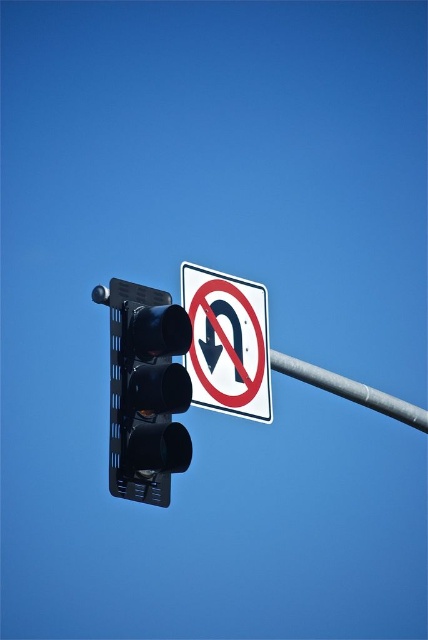
Between white plastic sign at upper center and metallic gray pole at center, which one is positioned lower?

metallic gray pole at center is below.

Does point (261, 420) come behind point (379, 401)?

No, it is in front of (379, 401).

The height and width of the screenshot is (640, 428). Identify the location of white plastic sign at upper center. (228, 342).

Can you confirm if black matte traffic light at left is positioned above white plastic sign at upper center?

No, black matte traffic light at left is not above white plastic sign at upper center.

Describe the element at coordinates (146, 392) in the screenshot. I see `black matte traffic light at left` at that location.

The image size is (428, 640). I want to click on black matte traffic light at left, so click(x=146, y=392).

Does point (171, 458) come behind point (311, 381)?

No, (171, 458) is closer to viewer.

Does black matte traffic light at left appear on the left side of metallic gray pole at center?

Correct, you'll find black matte traffic light at left to the left of metallic gray pole at center.

Measure the distance between point (x=166, y=339) and camera.

The distance of point (x=166, y=339) from camera is 34.00 meters.

I want to click on black matte traffic light at left, so click(146, 392).